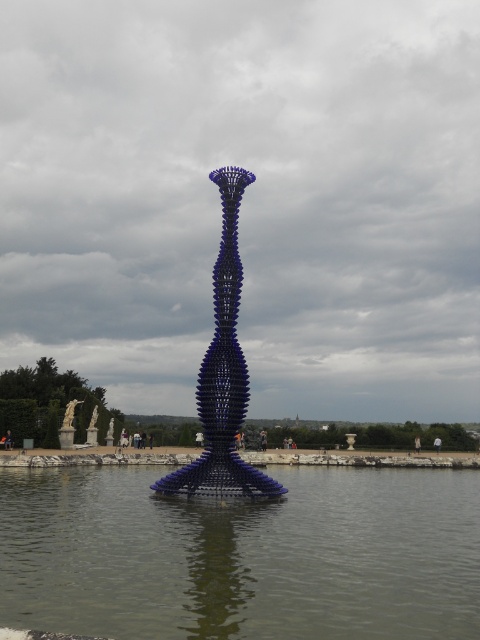
What do you see at coordinates (223, 374) in the screenshot? I see `blue glossy vase at center` at bounding box center [223, 374].

Is point (208, 428) positioned behind point (60, 442)?

No.

What are the coordinates of `blue glossy vase at center` in the screenshot? It's located at (223, 374).

How much distance is there between transparent water at center and white marble statue at left?

transparent water at center is 39.55 meters from white marble statue at left.

Can you confirm if transparent water at center is positioned above white marble statue at left?

Yes, transparent water at center is above white marble statue at left.

Is point (362, 480) closer to viewer compared to point (60, 445)?

Yes.

Find the location of a particular element. transparent water at center is located at coordinates (242, 556).

In the scene shown: Who is lower down, transparent water at center or blue glossy vase at center?

transparent water at center is below.

Is transparent water at center above blue glossy vase at center?

Incorrect, transparent water at center is not positioned above blue glossy vase at center.

Is point (368, 580) behind point (153, 483)?

No, it is in front of (153, 483).

Find the location of a particular element. transparent water at center is located at coordinates (242, 556).